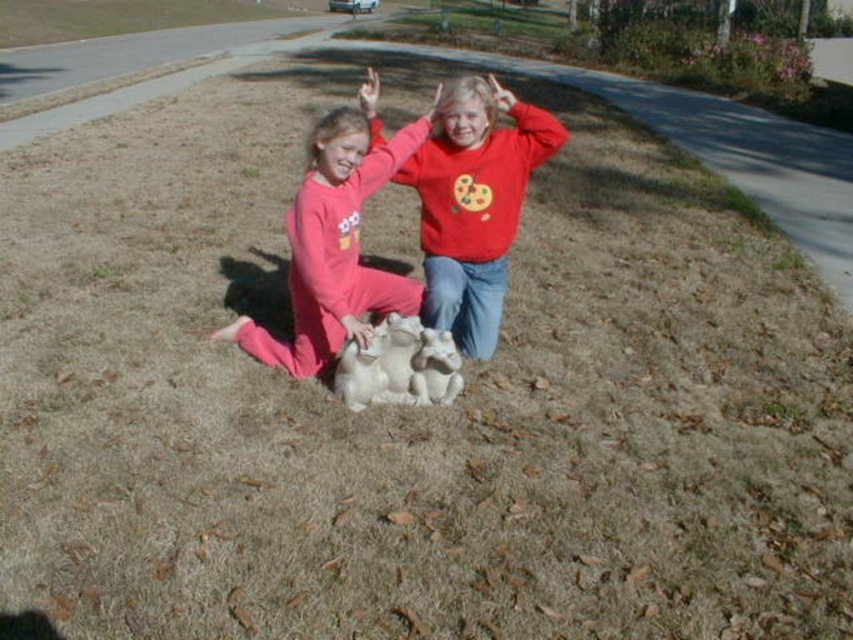
You are standing at the point where the two children are kneeling. You want to walk towards the direction where the sun is casting their shadows. Which point, point (432, 186) or point (345, 156), is closer to the direction you are facing?

Point (345, 156) is closer to the direction you are facing because it is in front of point (432, 186).

You are standing in the scene and see the two children wearing long red shirts. There is a point marked at coordinates (474, 202). Which child is closer to that point?

The matte red sweatshirt at center is located at point (474, 202), so the child wearing the matte red sweatshirt at center is closer to that point.

You are a photographer setting up a photo shoot for two children wearing the matte red sweatshirt at center and pink fleece pants at center. You want to ensure that the sweatshirt and pants are clearly visible in the final image. Which clothing item should you focus on more to ensure its size is adequately captured?

The matte red sweatshirt at center has a smaller size compared to the pink fleece pants at center, so you should focus more on the matte red sweatshirt at center to ensure its smaller size is adequately captured.